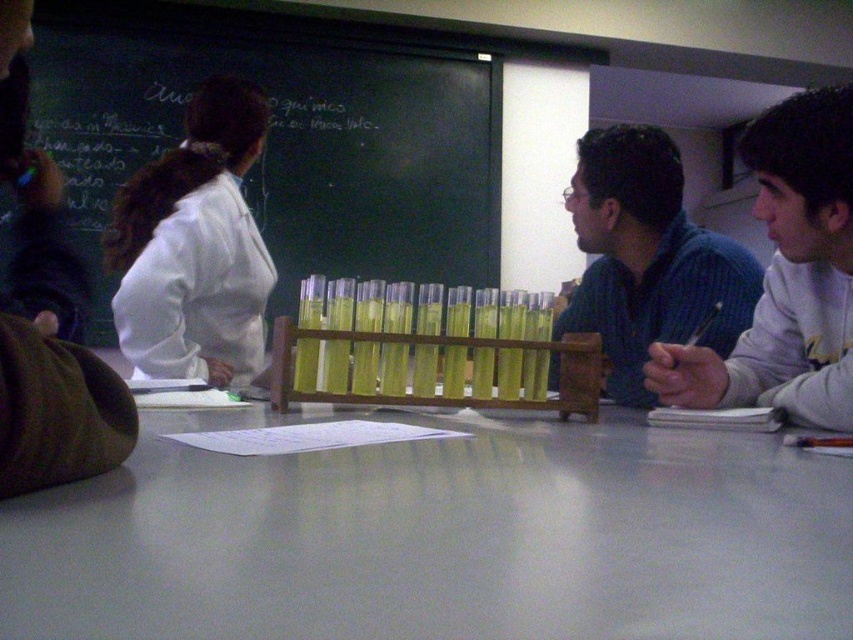
Question: Is white cotton shirt at right thinner than white lab coat at upper left?

Choices:
 (A) yes
 (B) no

Answer: (A)

Question: Does white glossy table at center have a smaller size compared to blue ribbed sweater at center?

Choices:
 (A) no
 (B) yes

Answer: (B)

Question: Can you confirm if transparent plastic test tubes at center is positioned to the right of white lab coat at upper left?

Choices:
 (A) no
 (B) yes

Answer: (A)

Question: Among these points, which one is nearest to the camera?

Choices:
 (A) (640, 588)
 (B) (201, 272)

Answer: (A)

Question: Which of the following is the closest to the observer?

Choices:
 (A) white glossy table at center
 (B) blue ribbed sweater at center

Answer: (A)

Question: Which point appears farthest from the camera in this image?

Choices:
 (A) (775, 115)
 (B) (225, 216)
 (C) (248, 195)

Answer: (C)